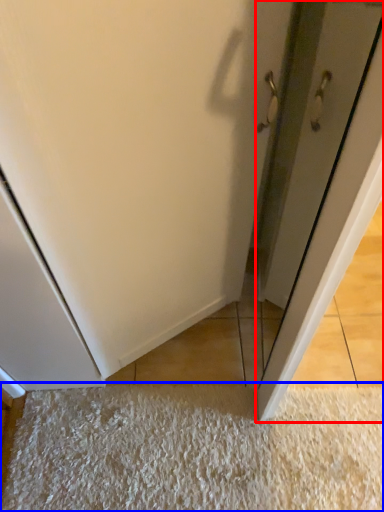
Question: Among these objects, which one is farthest to the camera, door (highlighted by a red box) or mat (highlighted by a blue box)?

Choices:
 (A) door
 (B) mat

Answer: (B)